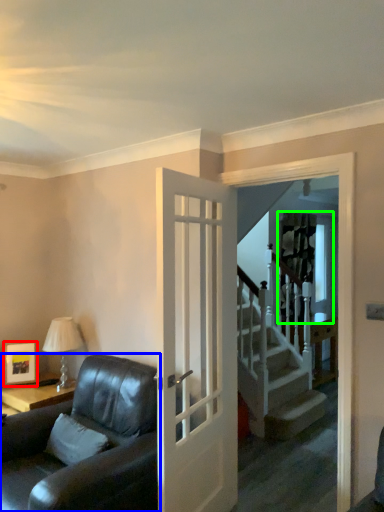
Question: Estimate the real-world distances between objects in this image. Which object is closer to picture frame (highlighted by a red box), studio couch (highlighted by a blue box) or window (highlighted by a green box)?

Choices:
 (A) studio couch
 (B) window

Answer: (A)